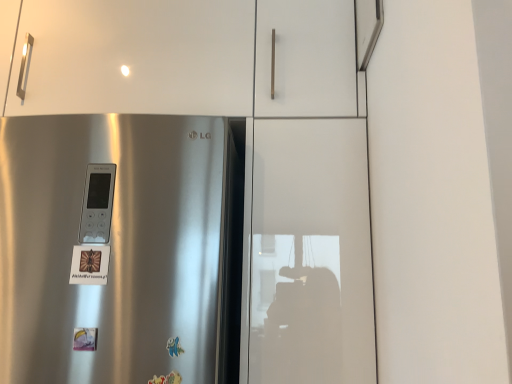
Where is `satin silver fridge at center`? satin silver fridge at center is located at coordinates (121, 248).

The image size is (512, 384). What do you see at coordinates (121, 248) in the screenshot?
I see `satin silver fridge at center` at bounding box center [121, 248].

Find the location of a particular element. This screenshot has width=512, height=384. satin silver fridge at center is located at coordinates (121, 248).